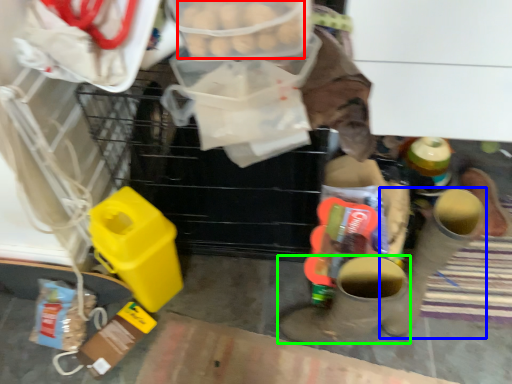
Question: Estimate the real-world distances between objects in this image. Which object is farther from food (highlighted by a red box), footwear (highlighted by a blue box) or footwear (highlighted by a green box)?

Choices:
 (A) footwear
 (B) footwear

Answer: (A)